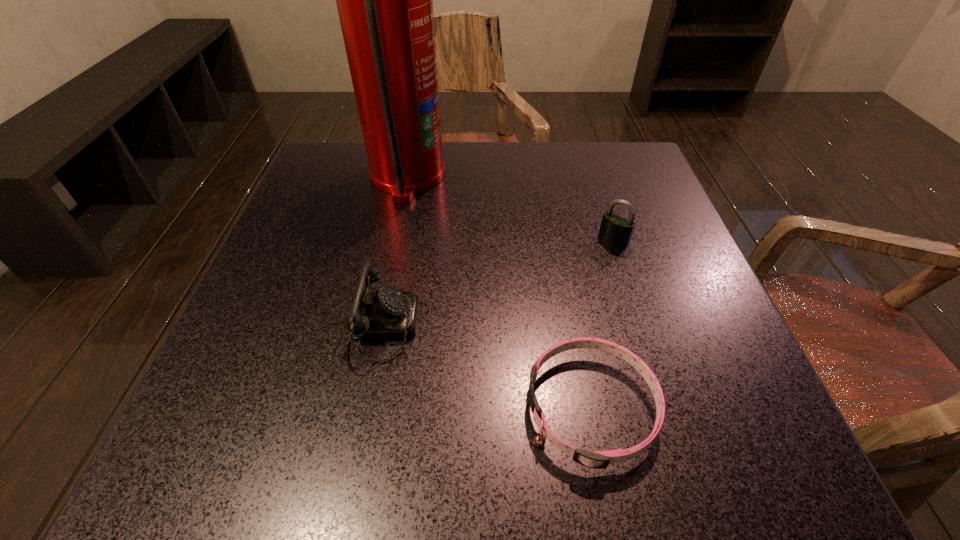
Image resolution: width=960 pixels, height=540 pixels. In order to click on free space located 0.290m with the buckle on the dog collar in this screenshot , I will do `click(321, 408)`.

I want to click on object that is positioned at the far edge, so click(x=384, y=0).

Image resolution: width=960 pixels, height=540 pixels. I want to click on object that is at the near edge, so click(600, 459).

I want to click on fire extinguisher present at the left edge, so click(384, 0).

Identify the location of telephone situated at the left edge. This screenshot has width=960, height=540. (387, 314).

The image size is (960, 540). I want to click on padlock at the right edge, so click(614, 229).

The width and height of the screenshot is (960, 540). In order to click on dog collar present at the right edge in this screenshot , I will do `click(600, 459)`.

Find the location of `object that is at the far left corner`. object that is at the far left corner is located at coordinates (384, 0).

Locate an element on the screen. object present at the near right corner is located at coordinates (600, 459).

In the image, there is a desktop. Identify the location of vacant space at the far edge. The height and width of the screenshot is (540, 960). (509, 185).